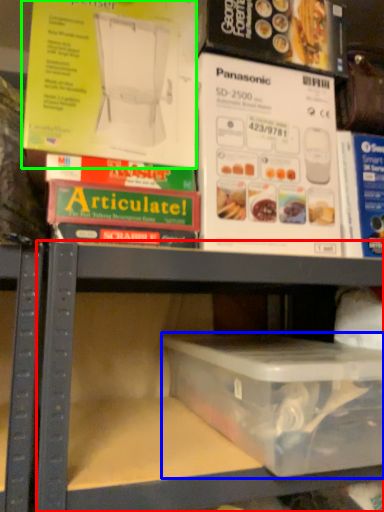
Question: Which is farther away from shelf (highlighted by a red box)? box (highlighted by a blue box) or paperback book (highlighted by a green box)?

Choices:
 (A) box
 (B) paperback book

Answer: (B)